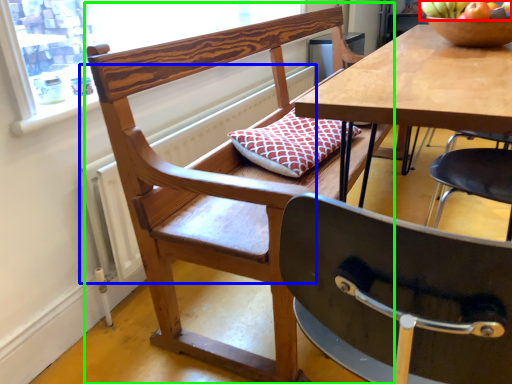
Question: Based on their relative distances, which object is nearer to fruit (highlighted by a red box)? Choose from radiator (highlighted by a blue box) and chair (highlighted by a green box).

Choices:
 (A) radiator
 (B) chair

Answer: (B)